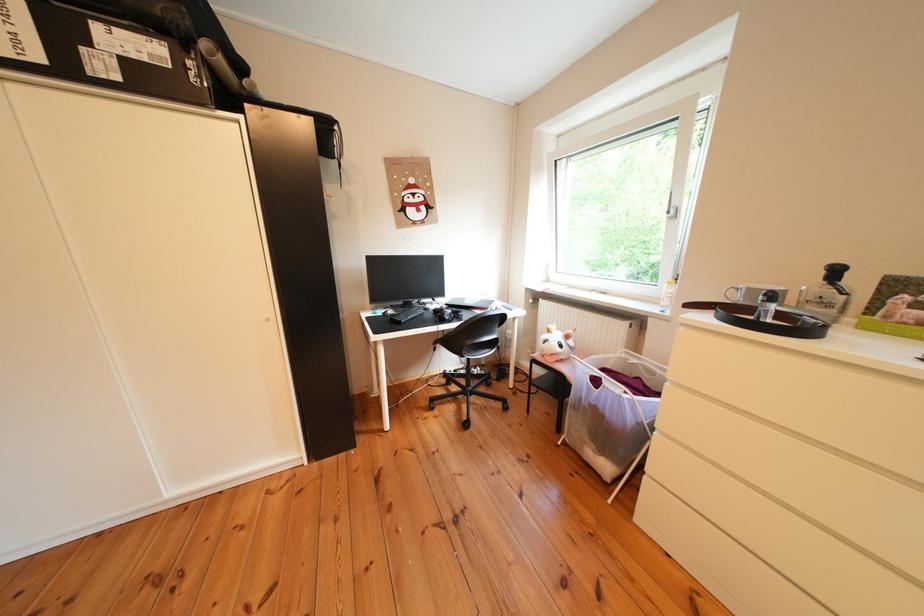
The width and height of the screenshot is (924, 616). Describe the element at coordinates (671, 208) in the screenshot. I see `a white window handle` at that location.